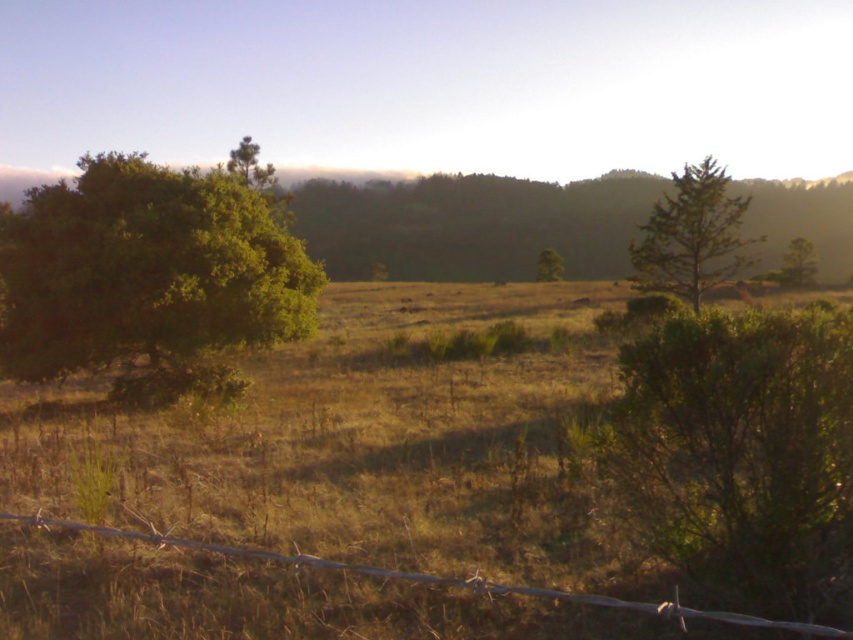
You are a landscape architect designing a new park layout. You need to place a bench between the green leafy tree at left and the metal wire fence at lower center. Which object should the bench be closer to if you want it to be equidistant from both but also ensure it doesn

The bench should be closer to the metal wire fence at lower center because the green leafy tree at left is wider than the metal wire fence at lower center, so placing it closer to the narrower object ensures equal distance from both.

You are a farmer checking the boundaries of your property. You see the metal wire fence at lower center and the green matte tree at upper center. Which one is closer to you based on their sizes?

The metal wire fence at lower center has a smaller size compared to the green matte tree at upper center, so the metal wire fence at lower center is closer to you.

You are a hiker standing at the barbed wire fence in the foreground of the scene. You want to take a photo of both the green matte tree at upper center and the green leafy tree at right in the same frame. Based on their positions, which tree should you position closer to the center of your camera view to include both in the photo?

Result: Since the green matte tree at upper center is to the left of the green leafy tree at right, you should position the green leafy tree at right closer to the center of your camera view to ensure both trees are included in the frame.